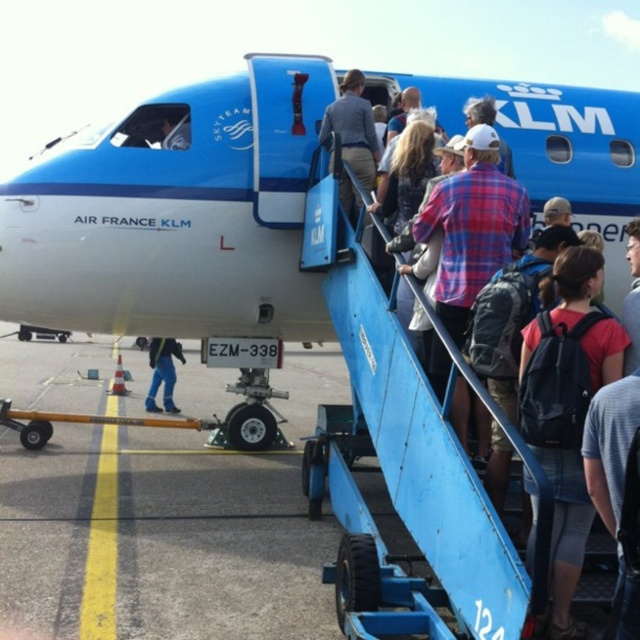
Between blue matte airplane at center and dark blue jeans at lower left, which one is positioned lower?

dark blue jeans at lower left

Is blue matte airplane at center positioned behind dark blue jeans at lower left?

That is False.

Does point (252, 54) lie behind point (150, 362)?

That is False.

Where is `blue matte airplane at center`? blue matte airplane at center is located at coordinates (177, 212).

Looking at this image, which is below, light gray fabric jacket at upper center or dark blue jeans at lower left?

dark blue jeans at lower left is below.

Which is behind, point (362, 77) or point (164, 340)?

The point (164, 340) is behind.

The image size is (640, 640). In order to click on light gray fabric jacket at upper center in this screenshot , I will do `click(353, 129)`.

Does dark blue backpack at center have a larger size compared to matte blue backpack at center-right?

Indeed, dark blue backpack at center has a larger size compared to matte blue backpack at center-right.

This screenshot has height=640, width=640. Describe the element at coordinates (582, 314) in the screenshot. I see `dark blue backpack at center` at that location.

Where is `dark blue backpack at center`? dark blue backpack at center is located at coordinates (582, 314).

Where is `dark blue backpack at center`? dark blue backpack at center is located at coordinates (582, 314).